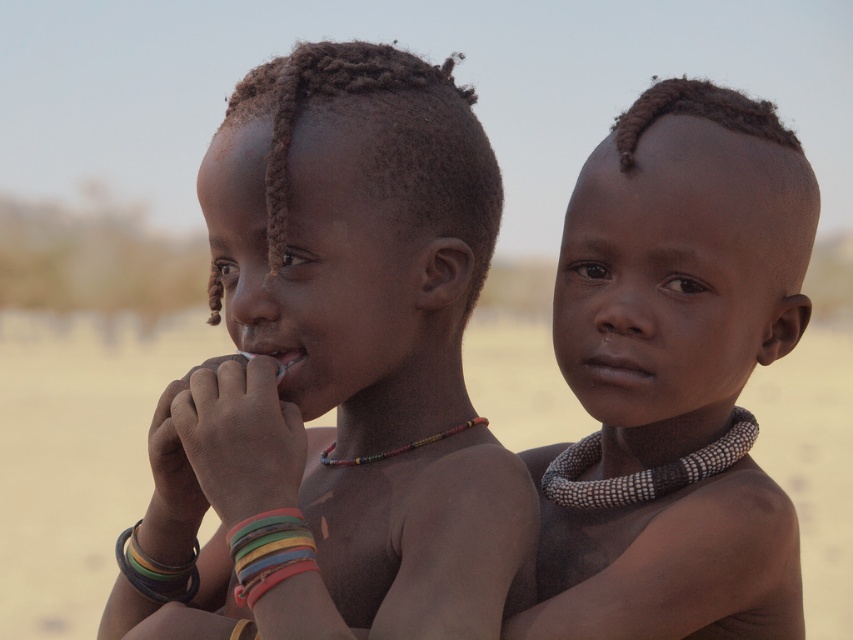
Can you confirm if dirt field at center is taller than multicolored plastic bangles at lower left?

Yes, dirt field at center is taller than multicolored plastic bangles at lower left.

Is dirt field at center wider than multicolored plastic bangles at lower left?

Correct, the width of dirt field at center exceeds that of multicolored plastic bangles at lower left.

Is point (32, 321) positioned behind point (296, 550)?

Yes, point (32, 321) is farther from viewer.

Image resolution: width=853 pixels, height=640 pixels. Find the location of `dirt field at center`. dirt field at center is located at coordinates (76, 456).

Is the position of dry skin at center less distant than that of multicolored rubber bracelets at lower left?

Yes, it is in front of multicolored rubber bracelets at lower left.

Between point (618, 381) and point (122, 531), which one is positioned behind?

The point (122, 531) is behind.

The image size is (853, 640). In order to click on dry skin at center in this screenshot , I will do `click(616, 369)`.

Does point (241, 83) come behind point (289, 356)?

Yes, point (241, 83) is behind point (289, 356).

Does point (239, 369) come closer to viewer compared to point (248, 353)?

Yes.

Find the location of `matte skin child at center`. matte skin child at center is located at coordinates (341, 364).